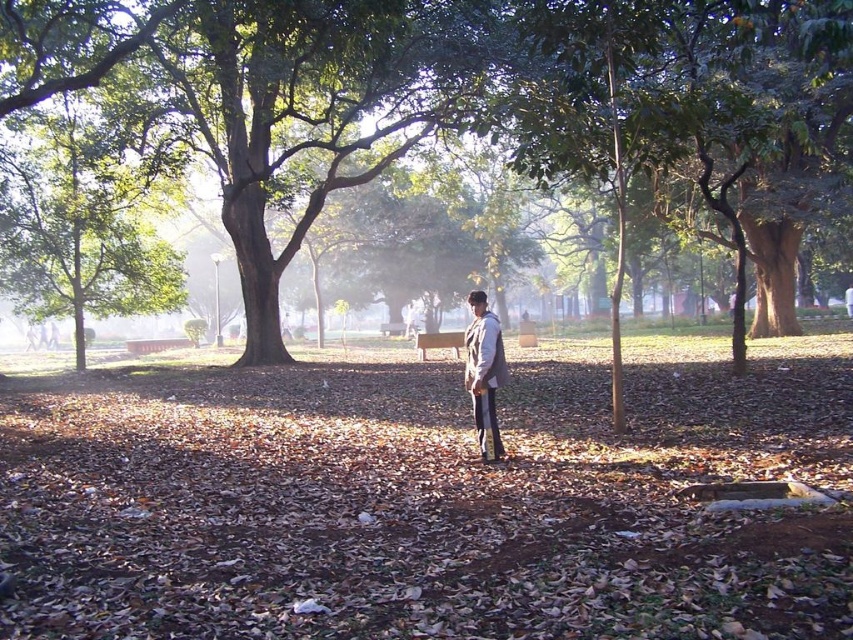
Can you confirm if green leafy tree at center is wider than light brown leather jacket at center?

Indeed, green leafy tree at center has a greater width compared to light brown leather jacket at center.

Is point (763, 4) positioned after point (482, 451)?

Yes, it is.

Locate an element on the screen. Image resolution: width=853 pixels, height=640 pixels. green leafy tree at center is located at coordinates (399, 88).

Can you confirm if brown matte ground at center is bigger than green leafy tree at center?

Actually, brown matte ground at center might be smaller than green leafy tree at center.

Looking at this image, is brown matte ground at center positioned at the back of green leafy tree at center?

No, brown matte ground at center is closer to the viewer.

Is point (477, 582) farther from camera compared to point (193, 90)?

No, (477, 582) is in front of (193, 90).

Identify the location of brown matte ground at center. This screenshot has width=853, height=640. (426, 493).

Does brown matte ground at center have a lesser height compared to light brown leather jacket at center?

No, brown matte ground at center is not shorter than light brown leather jacket at center.

Between brown matte ground at center and light brown leather jacket at center, which one is positioned lower?

brown matte ground at center

Does point (463, 474) lie in front of point (471, 332)?

Yes, it is in front of point (471, 332).

The height and width of the screenshot is (640, 853). In order to click on brown matte ground at center in this screenshot , I will do `click(426, 493)`.